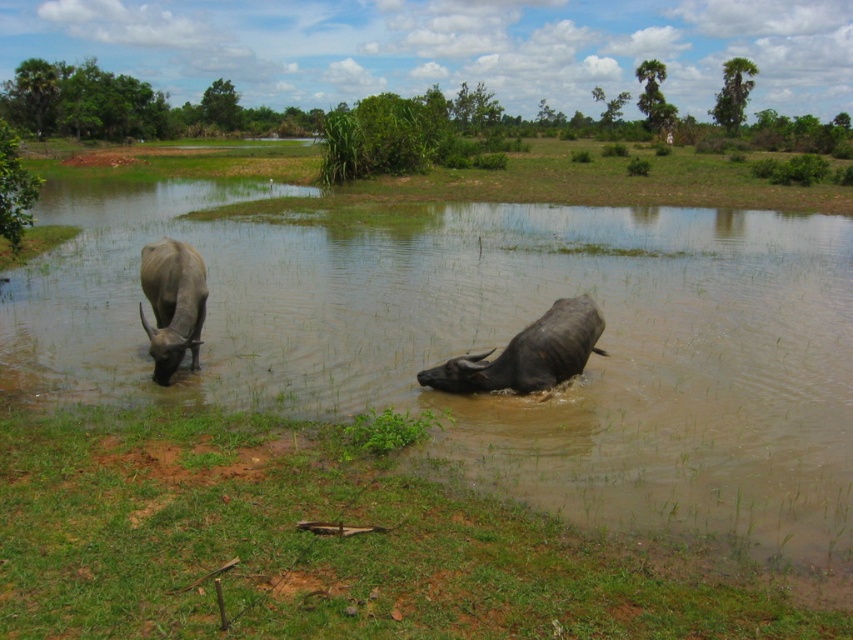
Question: Which is farther from the gray matte yak at left?

Choices:
 (A) dark gray wet bull at center
 (B) brown muddy river at center

Answer: (B)

Question: Can you confirm if brown muddy river at center is smaller than gray matte yak at left?

Choices:
 (A) yes
 (B) no

Answer: (B)

Question: Which point is closer to the camera?

Choices:
 (A) brown muddy river at center
 (B) gray matte yak at left

Answer: (A)

Question: Is brown muddy river at center smaller than gray matte yak at left?

Choices:
 (A) yes
 (B) no

Answer: (B)

Question: Can you confirm if green grass at lower left is positioned above dark gray wet bull at center?

Choices:
 (A) no
 (B) yes

Answer: (A)

Question: Which object appears farthest from the camera in this image?

Choices:
 (A) brown muddy river at center
 (B) green grass at lower left
 (C) dark gray wet bull at center

Answer: (C)